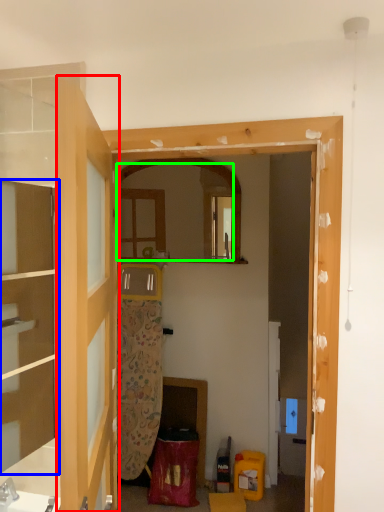
Question: Based on their relative distances, which object is farther from door (highlighted by a red box)? Choose from cabinetry (highlighted by a blue box) and mirror (highlighted by a green box).

Choices:
 (A) cabinetry
 (B) mirror

Answer: (B)